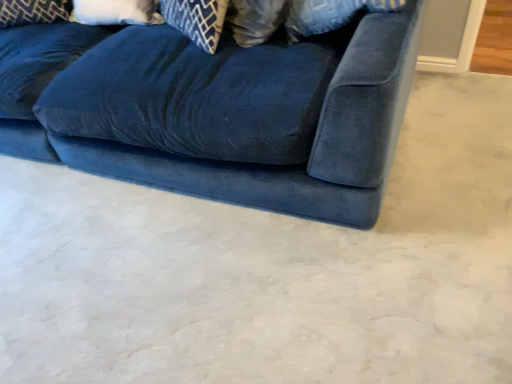
Question: Does velvet blue pillow at upper left, arranged as the first pillow when viewed from the left, have a larger size compared to white soft pillow at upper left, the first pillow when ordered from right to left?

Choices:
 (A) no
 (B) yes

Answer: (B)

Question: From a real-world perspective, is velvet blue pillow at upper left, which is the second pillow from right to left, positioned under white soft pillow at upper left, the first pillow when ordered from right to left, based on gravity?

Choices:
 (A) no
 (B) yes

Answer: (A)

Question: From the image's perspective, is velvet blue pillow at upper left, arranged as the first pillow when viewed from the left, on white soft pillow at upper left, the first pillow when ordered from right to left?

Choices:
 (A) no
 (B) yes

Answer: (B)

Question: Does velvet blue pillow at upper left, which is the second pillow from right to left, lie behind white soft pillow at upper left, the first pillow when ordered from right to left?

Choices:
 (A) yes
 (B) no

Answer: (A)

Question: Is velvet blue pillow at upper left, arranged as the first pillow when viewed from the left, not near white soft pillow at upper left, the first pillow when ordered from right to left?

Choices:
 (A) no
 (B) yes

Answer: (A)

Question: Are velvet blue pillow at upper left, arranged as the first pillow when viewed from the left, and white soft pillow at upper left, the first pillow when ordered from right to left, beside each other?

Choices:
 (A) yes
 (B) no

Answer: (B)

Question: Does white soft pillow at upper left, acting as the 2th pillow starting from the left, have a larger size compared to velvet blue couch at center?

Choices:
 (A) no
 (B) yes

Answer: (A)

Question: From the image's perspective, is white soft pillow at upper left, the first pillow when ordered from right to left, beneath velvet blue couch at center?

Choices:
 (A) yes
 (B) no

Answer: (B)

Question: Is white soft pillow at upper left, the first pillow when ordered from right to left, looking in the opposite direction of velvet blue couch at center?

Choices:
 (A) yes
 (B) no

Answer: (A)

Question: From a real-world perspective, is white soft pillow at upper left, the first pillow when ordered from right to left, positioned under velvet blue couch at center based on gravity?

Choices:
 (A) no
 (B) yes

Answer: (A)

Question: Is white soft pillow at upper left, acting as the 2th pillow starting from the left, far away from velvet blue couch at center?

Choices:
 (A) no
 (B) yes

Answer: (A)

Question: Considering the relative sizes of white soft pillow at upper left, acting as the 2th pillow starting from the left, and velvet blue couch at center in the image provided, is white soft pillow at upper left, acting as the 2th pillow starting from the left, wider than velvet blue couch at center?

Choices:
 (A) no
 (B) yes

Answer: (A)

Question: Is velvet blue pillow at upper left, arranged as the first pillow when viewed from the left, thinner than velvet blue couch at center?

Choices:
 (A) yes
 (B) no

Answer: (A)